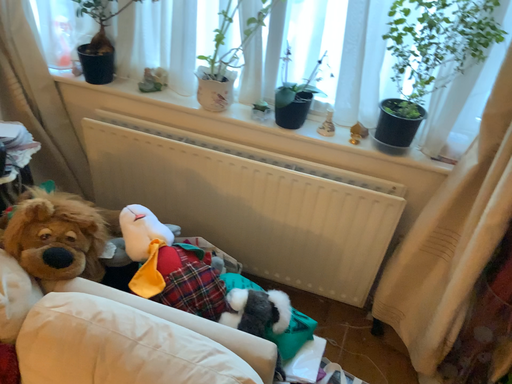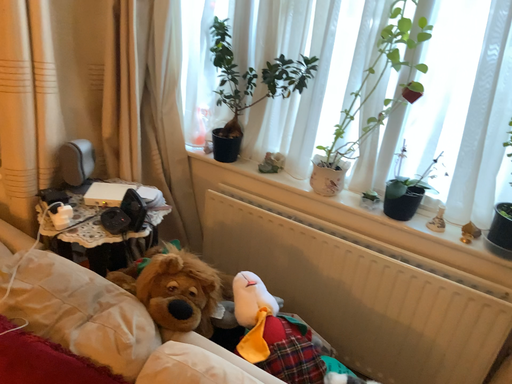
Question: How did the camera likely rotate when shooting the video?

Choices:
 (A) rotated upward
 (B) rotated downward

Answer: (A)